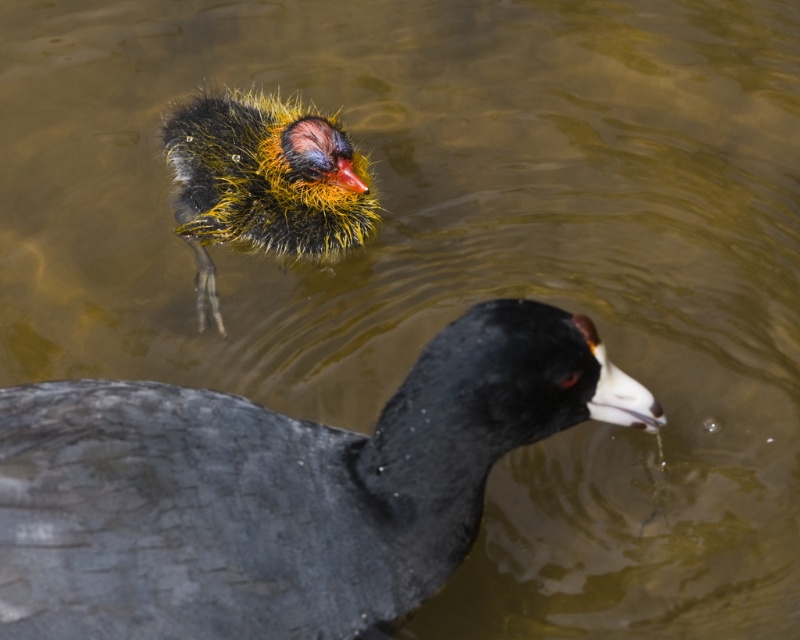
Question: Does shiny black duck at center have a greater width compared to fluffy yellow-black duckling at upper left?

Choices:
 (A) no
 (B) yes

Answer: (B)

Question: Which point is farther to the camera?

Choices:
 (A) (200, 317)
 (B) (360, 436)

Answer: (A)

Question: Does shiny black duck at center have a greater width compared to fluffy yellow-black duckling at upper left?

Choices:
 (A) yes
 (B) no

Answer: (A)

Question: Which point is farther to the camera?

Choices:
 (A) fluffy yellow-black duckling at upper left
 (B) shiny black duck at center

Answer: (A)

Question: Is shiny black duck at center wider than fluffy yellow-black duckling at upper left?

Choices:
 (A) yes
 (B) no

Answer: (A)